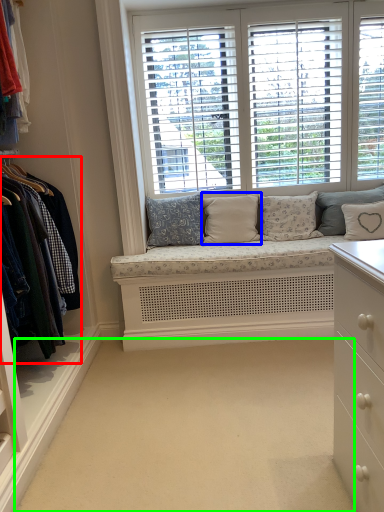
Question: Which is nearer to the closet (highlighted by a red box)? pillow (highlighted by a blue box) or plain (highlighted by a green box).

Choices:
 (A) pillow
 (B) plain

Answer: (B)